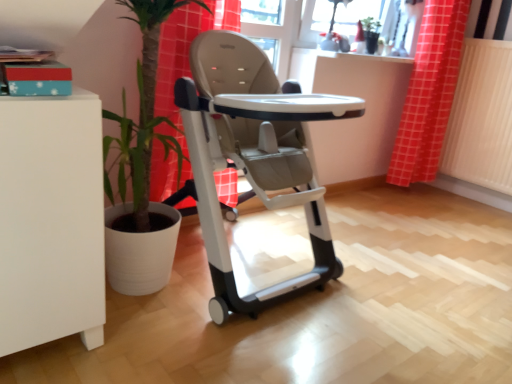
You are a GUI agent. You are given a task and a screenshot of the screen. Output one action in this format:
    pyautogui.click(x=<x>, y=<y>)
    Task: Click on the red checkered curtain at upper right
    This screenshot has height=384, width=512.
    Given the screenshot: What is the action you would take?
    (x=429, y=93)

What do you see at coordinates (481, 117) in the screenshot?
I see `white textured radiator at right` at bounding box center [481, 117].

Find the location of a particular element. white textured radiator at right is located at coordinates (481, 117).

What is the approximate width of matte gray high chair at center?

matte gray high chair at center is 33.68 inches wide.

Where is `red checkered curtain at upper right`? red checkered curtain at upper right is located at coordinates pos(429,93).

Are matte glass window screen at upper center and matte gray high chair at center beside each other?

No, matte glass window screen at upper center is not beside matte gray high chair at center.

Looking at this image, how different are the orientations of matte glass window screen at upper center and matte gray high chair at center in degrees?

matte glass window screen at upper center and matte gray high chair at center are facing 1.97 degrees away from each other.

Which of these two, matte glass window screen at upper center or matte gray high chair at center, is bigger?

matte gray high chair at center.

Considering the relative positions of matte glass window screen at upper center and matte gray high chair at center in the image provided, is matte glass window screen at upper center in front of matte gray high chair at center?

No, it is behind matte gray high chair at center.

You are a GUI agent. You are given a task and a screenshot of the screen. Output one action in this format:
    pyautogui.click(x=<x>, y=<y>)
    Task: Click on the curtain that is above the matte gray high chair at center (from a real-world perspective)
    
    Given the screenshot: What is the action you would take?
    pyautogui.click(x=429, y=93)

Is red checkered curtain at upper right spatially inside matte gray high chair at center, or outside of it?

The correct answer is: outside.

From the picture: Is red checkered curtain at upper right aimed at matte gray high chair at center?

No, red checkered curtain at upper right is not facing towards matte gray high chair at center.

Considering the sizes of red checkered curtain at upper right and matte gray high chair at center in the image, is red checkered curtain at upper right taller or shorter than matte gray high chair at center?

In the image, red checkered curtain at upper right appears to be taller than matte gray high chair at center.

In order to click on window screen in front of the red checkered curtain at upper right in this screenshot , I will do 314,21.

From the picture: Considering the relative positions of red checkered curtain at upper right and matte glass window screen at upper center in the image provided, is red checkered curtain at upper right to the right of matte glass window screen at upper center from the viewer's perspective?

Indeed, red checkered curtain at upper right is positioned on the right side of matte glass window screen at upper center.

Is there a large distance between red checkered curtain at upper right and matte glass window screen at upper center?

No, red checkered curtain at upper right is not far away from matte glass window screen at upper center.

Looking at their sizes, would you say red checkered curtain at upper right is wider or thinner than matte glass window screen at upper center?

Considering their sizes, red checkered curtain at upper right looks broader than matte glass window screen at upper center.

Does point (247, 311) come farther from viewer compared to point (478, 139)?

No.

Does matte gray high chair at center appear on the left side of white textured radiator at right?

Yes, matte gray high chair at center is to the left of white textured radiator at right.

How distant is matte gray high chair at center from white textured radiator at right?

They are 5.69 feet apart.

Is matte gray high chair at center located outside white textured radiator at right?

Yes.

Where is `radiator that appears below the matte glass window screen at upper center (from a real-world perspective)`? radiator that appears below the matte glass window screen at upper center (from a real-world perspective) is located at coordinates (481, 117).

Which object is closer to the camera taking this photo, white textured radiator at right or matte glass window screen at upper center?

matte glass window screen at upper center is more forward.

From a real-world perspective, is white textured radiator at right physically located above or below matte glass window screen at upper center?

white textured radiator at right is situated lower than matte glass window screen at upper center in the real world.

What's the angular difference between white textured radiator at right and matte glass window screen at upper center's facing directions?

They differ by 91.8 degrees in their facing directions.

Between point (317, 38) and point (448, 44), which one is positioned in front?

The point (317, 38) is closer.

Considering the relative positions of matte glass window screen at upper center and red checkered curtain at upper right in the image provided, is matte glass window screen at upper center behind red checkered curtain at upper right?

No, matte glass window screen at upper center is closer to the viewer.

From a real-world perspective, between matte glass window screen at upper center and red checkered curtain at upper right, who is vertically lower?

red checkered curtain at upper right.

Considering the relative sizes of matte gray high chair at center and red checkered curtain at upper right in the image provided, is matte gray high chair at center smaller than red checkered curtain at upper right?

Actually, matte gray high chair at center might be larger than red checkered curtain at upper right.

From the picture: From the image's perspective, is matte gray high chair at center above red checkered curtain at upper right?

Incorrect, from the image's perspective, matte gray high chair at center is lower than red checkered curtain at upper right.

From a real-world perspective, which is physically above, matte gray high chair at center or red checkered curtain at upper right?

red checkered curtain at upper right, from a real-world perspective.

Does matte gray high chair at center appear on the right side of red checkered curtain at upper right?

No.

Locate an element on the screen. The width and height of the screenshot is (512, 384). window screen above the matte gray high chair at center (from the image's perspective) is located at coordinates (314, 21).

Image resolution: width=512 pixels, height=384 pixels. I want to click on baby carriage on the left of red checkered curtain at upper right, so click(254, 156).

When comparing their distances from red checkered curtain at upper right, does white textured radiator at right or matte gray high chair at center seem further?

matte gray high chair at center lies further to red checkered curtain at upper right than the other object.

When comparing their distances from white textured radiator at right, does matte gray high chair at center or red checkered curtain at upper right seem closer?

red checkered curtain at upper right is closer to white textured radiator at right.

From the image, which object appears to be nearer to matte glass window screen at upper center, white textured radiator at right or matte gray high chair at center?

white textured radiator at right is closer to matte glass window screen at upper center.

Considering their positions, is matte gray high chair at center positioned further to red checkered curtain at upper right than matte glass window screen at upper center?

The object further to red checkered curtain at upper right is matte gray high chair at center.

In the scene shown: When comparing their distances from matte glass window screen at upper center, does red checkered curtain at upper right or white textured radiator at right seem closer?

red checkered curtain at upper right is closer to matte glass window screen at upper center.

Considering their positions, is red checkered curtain at upper right positioned closer to matte gray high chair at center than matte glass window screen at upper center?

Among the two, matte glass window screen at upper center is located nearer to matte gray high chair at center.

Looking at the image, which one is located closer to matte glass window screen at upper center, matte gray high chair at center or red checkered curtain at upper right?

red checkered curtain at upper right lies closer to matte glass window screen at upper center than the other object.

From the image, which object appears to be nearer to matte glass window screen at upper center, red checkered curtain at upper right or matte gray high chair at center?

red checkered curtain at upper right.

At what (x,y) coordinates should I click in order to perform the action: click on curtain situated between matte gray high chair at center and white textured radiator at right from left to right. Please return your answer as a coordinate pair (x, y). Image resolution: width=512 pixels, height=384 pixels. Looking at the image, I should click on (429, 93).

This screenshot has height=384, width=512. I want to click on window screen between matte gray high chair at center and red checkered curtain at upper right from front to back, so click(x=314, y=21).

Where is `window screen situated between matte gray high chair at center and white textured radiator at right from left to right`? The image size is (512, 384). window screen situated between matte gray high chair at center and white textured radiator at right from left to right is located at coordinates (314, 21).

At what (x,y) coordinates should I click in order to perform the action: click on curtain located between matte glass window screen at upper center and white textured radiator at right in the left-right direction. Please return your answer as a coordinate pair (x, y). Looking at the image, I should click on (429, 93).